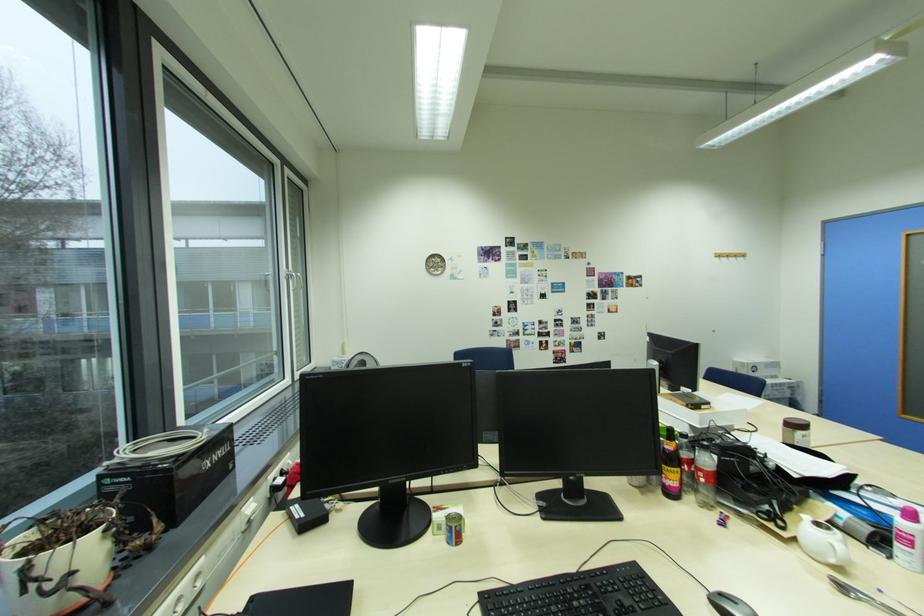
Where is `computer mouse`? The height and width of the screenshot is (616, 924). computer mouse is located at coordinates (728, 604).